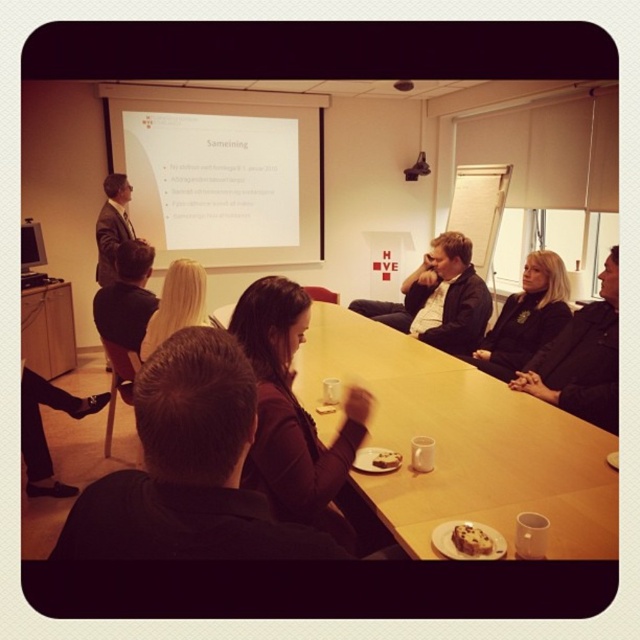
You are sitting at the wooden table at center and want to reach the door located at the far end of the room. Considering the table is at point 0.691, 0.722, can you estimate if you need to move forward or backward to exit?

The wooden table at center is located at point (461, 442), which suggests it is closer to the back of the room. To exit through the door at the far end, you would need to move forward towards the front of the room where the door is likely located.

You are a participant in the conference room and want to place a small note on the wooden table at center. The point you are aiming for is point (461, 442). Is this point on the wooden table at center?

Yes, the point (461, 442) is on the wooden table at center, so you can place your note there.